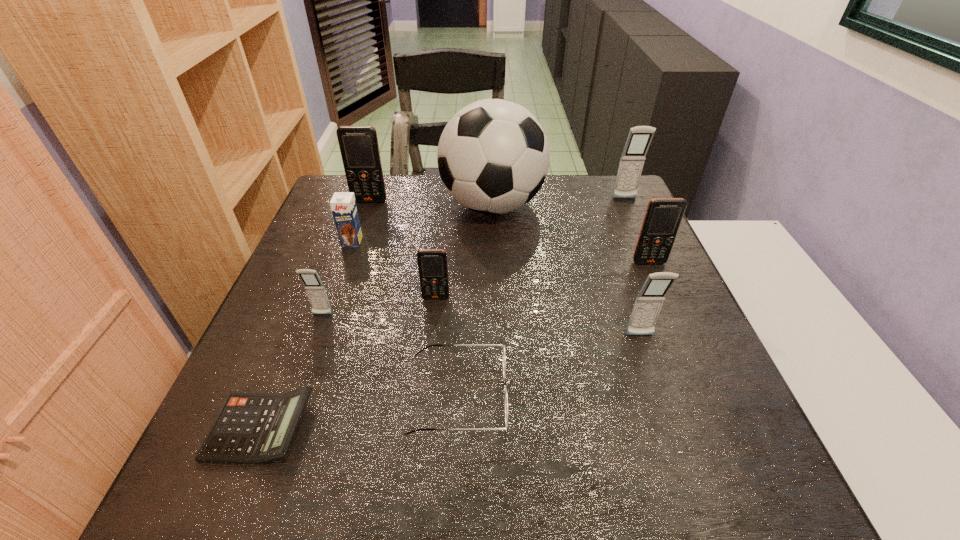
Where is `free region located on the screen of the biggest orange cellular telephone`? free region located on the screen of the biggest orange cellular telephone is located at coordinates (363, 222).

Find the location of a particular element. The height and width of the screenshot is (540, 960). free space located 0.060m on the front-facing side of the third cellular telephone from right to left is located at coordinates (650, 364).

The height and width of the screenshot is (540, 960). What are the coordinates of `free region located 0.350m on the screen of the second farthest orange cellular telephone` in the screenshot? It's located at (705, 390).

In order to click on vacant space located on the front label of the chocolate milk in this screenshot , I will do `click(317, 343)`.

I want to click on free space located on the screen of the third cellular telephone from left to right, so click(x=417, y=484).

You are a GUI agent. You are given a task and a screenshot of the screen. Output one action in this format:
    pyautogui.click(x=<x>, y=<y>)
    Task: Click on the vacant space located 0.290m on the front-facing side of the leftmost gray cellular telephone
    The height and width of the screenshot is (540, 960).
    Given the screenshot: What is the action you would take?
    pyautogui.click(x=274, y=449)

The height and width of the screenshot is (540, 960). Find the location of `vacant space located 0.050m on the front-facing side of the second shortest object`. vacant space located 0.050m on the front-facing side of the second shortest object is located at coordinates (536, 395).

Image resolution: width=960 pixels, height=540 pixels. What are the coordinates of `free space located on the front of the calculator` in the screenshot? It's located at (232, 499).

Identify the location of soccer ball that is at the far edge. This screenshot has height=540, width=960. (493, 155).

Locate an element on the screen. object that is at the near edge is located at coordinates (251, 428).